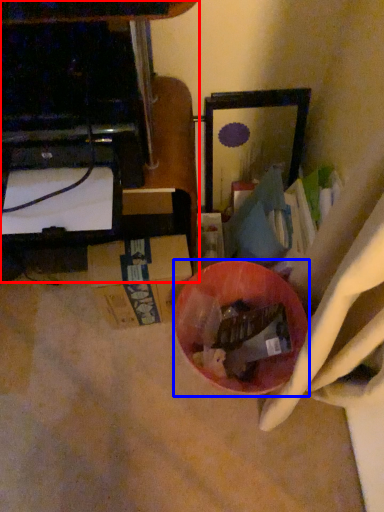
Question: Which object appears closest to the camera in this image, furniture (highlighted by a red box) or bowl (highlighted by a blue box)?

Choices:
 (A) furniture
 (B) bowl

Answer: (A)